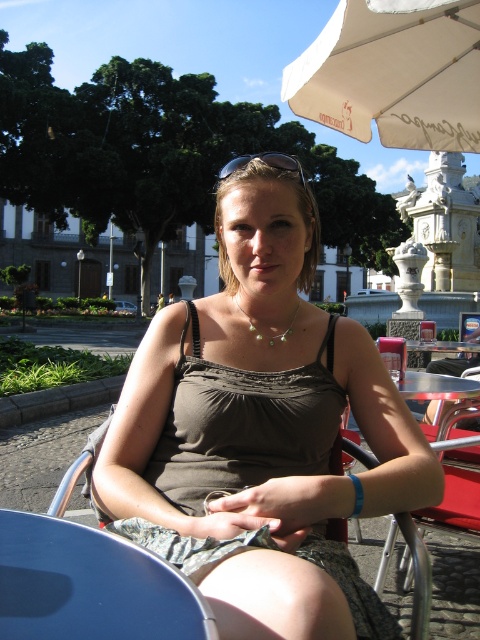
Who is more distant from viewer, (179, 608) or (273, 342)?

The point (273, 342) is more distant.

Is point (58, 538) farther from viewer compared to point (290, 324)?

No.

Does point (36, 624) lie in front of point (292, 314)?

Yes, point (36, 624) is in front of point (292, 314).

Where is `blue glossy table at lower left`? This screenshot has height=640, width=480. blue glossy table at lower left is located at coordinates (90, 586).

Does point (324, 90) come farther from viewer compared to point (286, 337)?

Yes, point (324, 90) is farther from viewer.

This screenshot has height=640, width=480. Find the location of `white fabric umbrella at upper center`. white fabric umbrella at upper center is located at coordinates (394, 74).

Identify the location of white fabric umbrella at upper center. The image size is (480, 640). (394, 74).

At what (x,y) coordinates should I click in order to perform the action: click on white fabric umbrella at upper center. Please return your answer as a coordinate pair (x, y). The image size is (480, 640). Looking at the image, I should click on (394, 74).

Is matte brown tank top at center wider than blue glossy table at lower left?

Indeed, matte brown tank top at center has a greater width compared to blue glossy table at lower left.

Which of these two, matte brown tank top at center or blue glossy table at lower left, stands taller?

matte brown tank top at center is taller.

Image resolution: width=480 pixels, height=640 pixels. In order to click on matte brown tank top at center in this screenshot , I will do `click(260, 432)`.